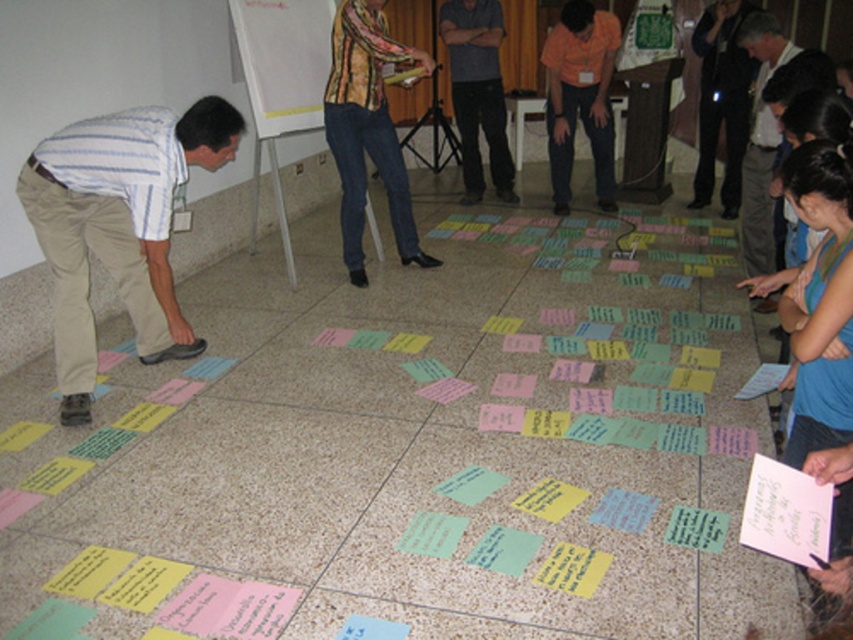
In the scene shown: You are a participant in the brainstorming session and need to move from your current position to the whiteboard. There are two people with khaki cotton pants at lower left and dark gray pants at lower right blocking your path. Which direction should you go around them to avoid stepping on the sticky notes?

The khaki cotton pants at lower left is positioned on the left side of dark gray pants at lower right. To avoid stepping on the sticky notes, you should go around to the right side of the dark gray pants at lower right or the left side of the khaki cotton pants at lower left.

You are part of the brainstorming group and need to locate the striped cotton shirt at center. Which direction should you look relative to the dark gray shirt at center?

The striped cotton shirt at center is positioned under the dark gray shirt at center, so you should look downward from the dark gray shirt at center to find it.

Based on the photo, you are a photographer trying to capture a closeup of the sticky notes on the floor. You need to ensure that both the khaki cotton pants at lower left and the dark gray pants at lower right are visible in the frame. Given their sizes, which pair of pants will appear bigger in the photo?

The khaki cotton pants at lower left will appear bigger in the photo because they have a larger size compared to the dark gray pants at lower right.